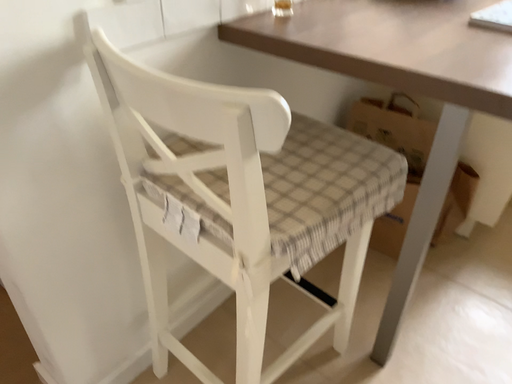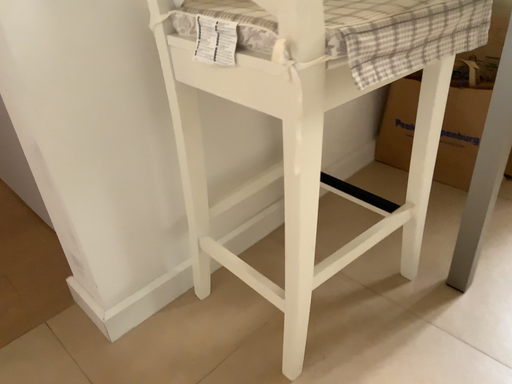
Question: Which way did the camera rotate in the video?

Choices:
 (A) rotated right
 (B) rotated left

Answer: (B)